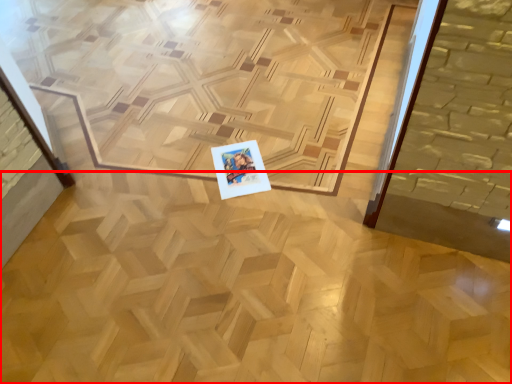
Question: In this image, where is plywood (annotated by the red box) located relative to postcard?

Choices:
 (A) right
 (B) left

Answer: (B)